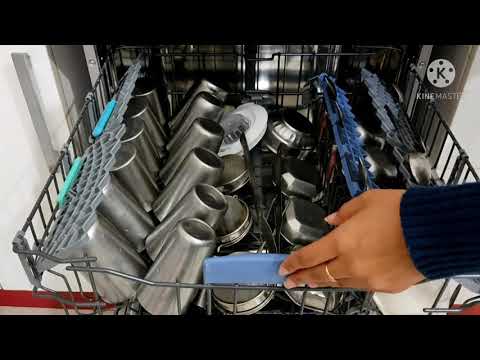
Find the location of a particular element. This screenshot has width=480, height=360. dishwasher is located at coordinates (267, 76), (95, 56), (424, 52).